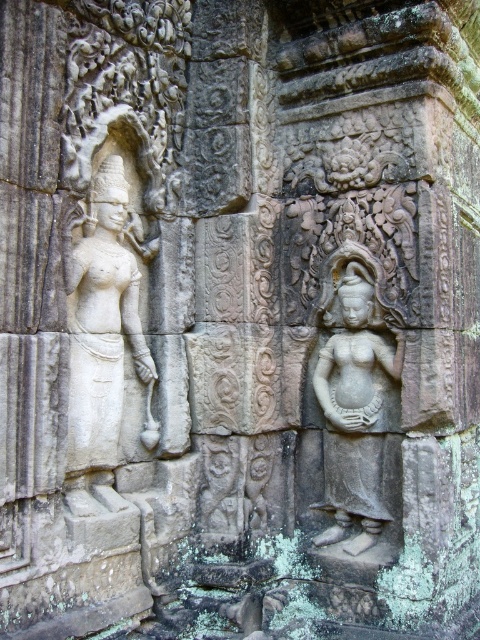
In the scene shown: Who is lower down, white stone statue at left or gray stone statue at center?

Positioned lower is gray stone statue at center.

In order to click on white stone statue at left in this screenshot , I will do `click(99, 337)`.